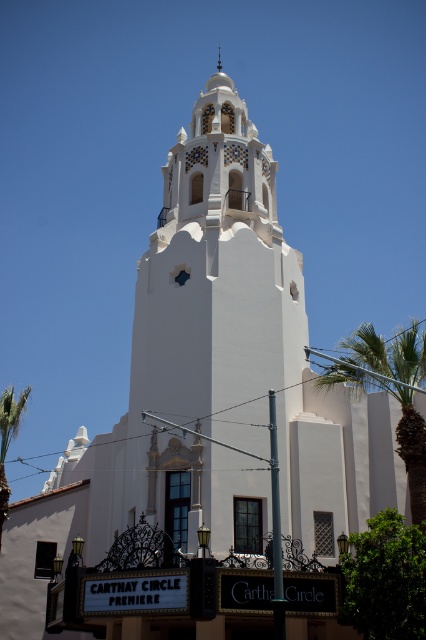
You are standing in front of the building and notice two points marked on the structure. The first point is located at coordinates point (236, 134), and the second is at point (353, 378). Which point is closer to you?

Point (236, 134) is closer to you because it is further to the camera than point (353, 378).

You are standing in front of the building and want to take a photo that includes both the white stucco bell tower at center and the green leafy palm tree at right. Which object should you position closer to the edge of the frame to ensure both fit in the shot?

Since the white stucco bell tower at center is smaller than the green leafy palm tree at right, you should position the green leafy palm tree at right closer to the edge of the frame to ensure both fit in the shot.